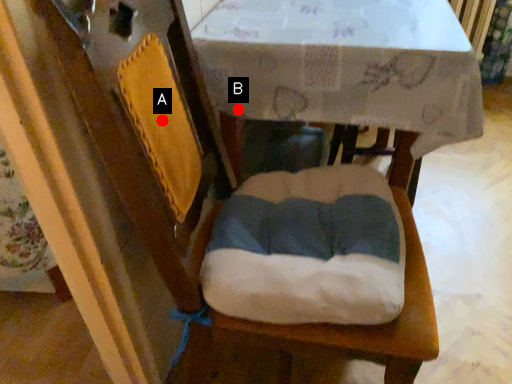
Question: Two points are circled on the image, labeled by A and B beside each circle. Which point is closer to the camera?

Choices:
 (A) A is closer
 (B) B is closer

Answer: (A)